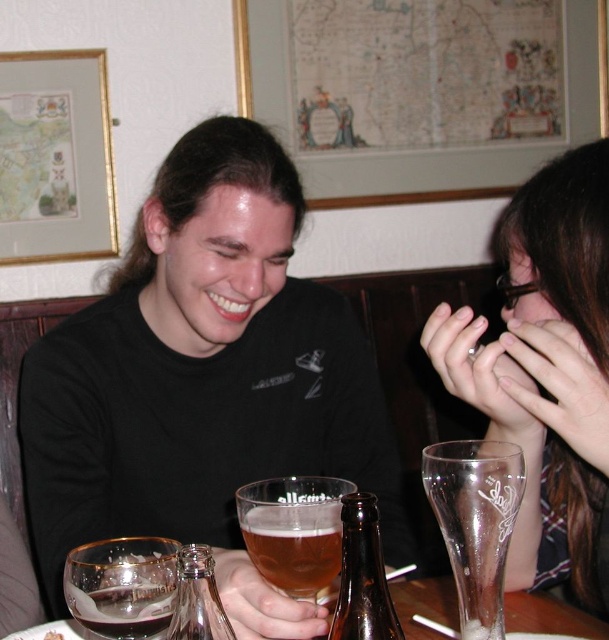
Question: Which object appears closest to the camera in this image?

Choices:
 (A) clear plastic glass at right
 (B) brown glass bottle at center
 (C) transparent glass at lower left

Answer: (B)

Question: Can you confirm if black matte shirt at center is wider than transparent glass at lower left?

Choices:
 (A) yes
 (B) no

Answer: (A)

Question: Does translucent glass beer at center come behind transparent glass at lower left?

Choices:
 (A) yes
 (B) no

Answer: (A)

Question: Which point is closer to the camera?

Choices:
 (A) (357, 554)
 (B) (561, 580)
 (C) (406, 596)
 (D) (276, 577)

Answer: (A)

Question: Can you confirm if clear glass beer glass at right is wider than translucent glass beer at center?

Choices:
 (A) yes
 (B) no

Answer: (B)

Question: Which point appears farthest from the camera in this image?

Choices:
 (A) (163, 611)
 (B) (462, 506)
 (C) (259, 497)

Answer: (C)